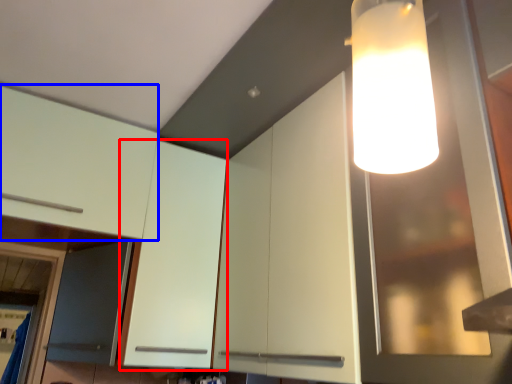
Question: Which object appears closest to the camera in this image, cabinetry (highlighted by a red box) or cabinetry (highlighted by a blue box)?

Choices:
 (A) cabinetry
 (B) cabinetry

Answer: (B)